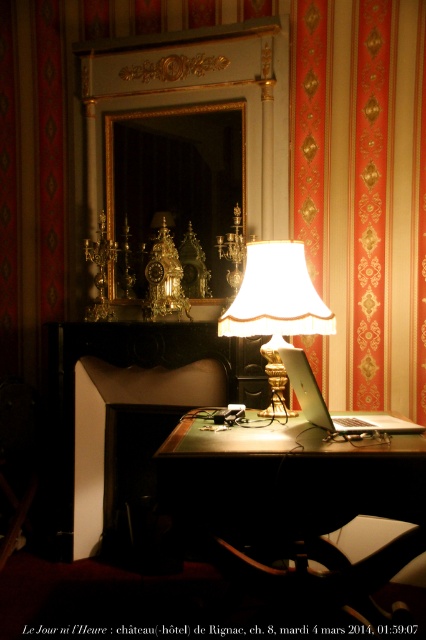
You are a delivery person who needs to place a small package on the desk without blocking the laptop. The package requires 10 inches of space. Can you fit it between the metallic silver table at center and the satin silver laptop at center?

The metallic silver table at center and satin silver laptop at center are 12.42 inches apart from each other, so yes, the package requiring 10 inches of space can fit between them.

You are organizing the items on the desk and need to place a new rectangular box that is 10 cm thick. The box must be placed between the white fabric lampshade at center and the satin silver laptop at center. Can both items accommodate this box between them?

The white fabric lampshade at center is thinner than the satin silver laptop at center. Since the box is 10 cm thick, it can fit between them if the distance between the two items is at least 10 cm. However, the description only states their relative thickness, not the actual distance between them. Therefore, it is uncertain if there is enough space to place the box between them.

You are a guest at the chateau and want to place your phone on the metallic silver table at center. Can you confirm if the table is higher than the satin silver laptop at center?

The metallic silver table at center is much taller than the satin silver laptop at center, so yes, the table is higher than the laptop.